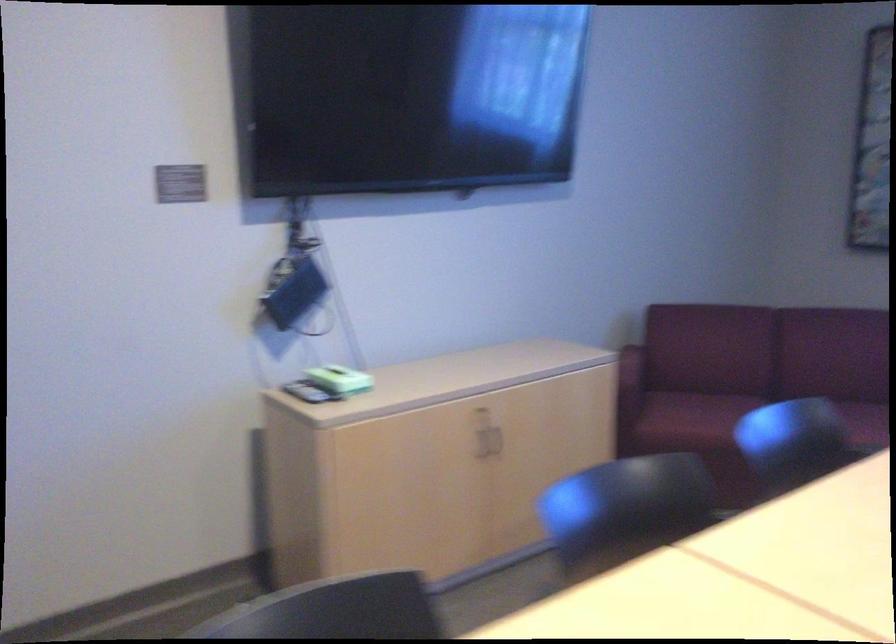
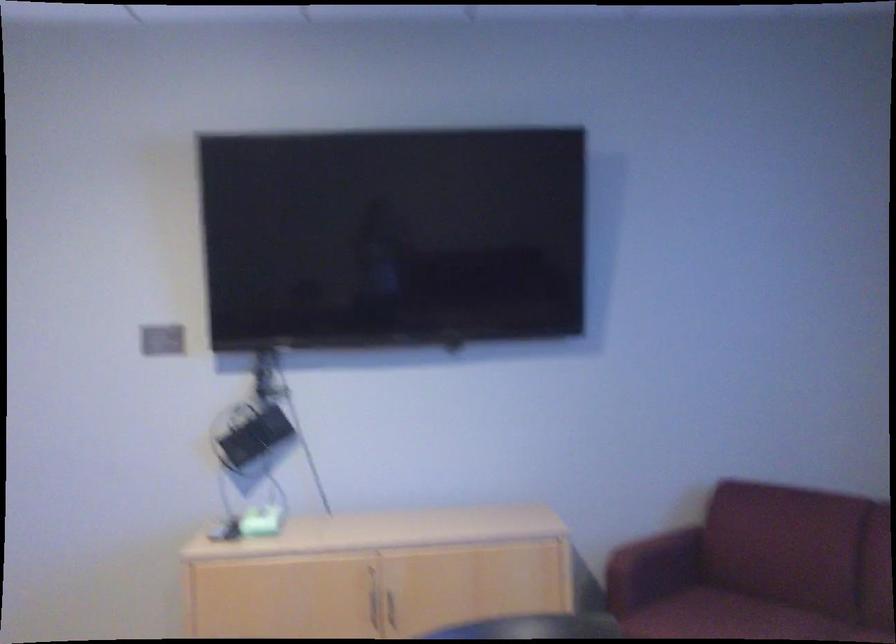
The point at (490,438) is marked in the first image. Where is the corresponding point in the second image?

(392, 607)